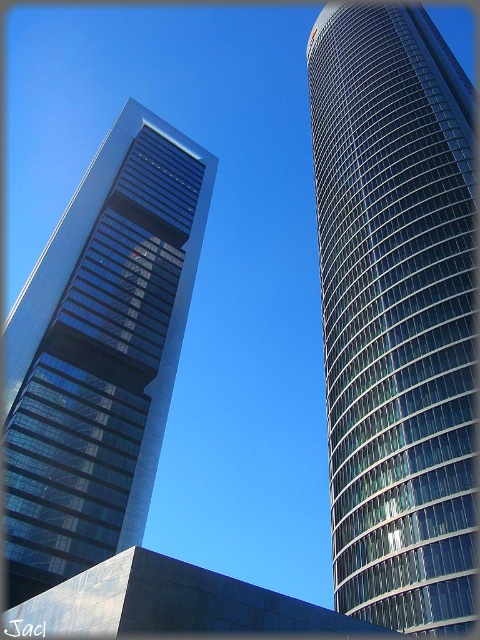
Question: Is shiny glass skyscraper at right bigger than transparent glass skyscraper at left?

Choices:
 (A) yes
 (B) no

Answer: (A)

Question: Which point is farther to the camera?

Choices:
 (A) click(91, 372)
 (B) click(467, 435)

Answer: (A)

Question: Does shiny glass skyscraper at right appear on the right side of transparent glass skyscraper at left?

Choices:
 (A) yes
 (B) no

Answer: (A)

Question: Among these objects, which one is nearest to the camera?

Choices:
 (A) transparent glass skyscraper at left
 (B) shiny glass skyscraper at right

Answer: (B)

Question: Is shiny glass skyscraper at right to the right of transparent glass skyscraper at left from the viewer's perspective?

Choices:
 (A) no
 (B) yes

Answer: (B)